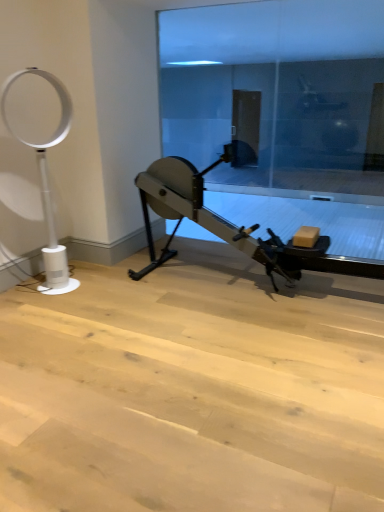
Where is `vacant area in front of transparent glass door at center`? Image resolution: width=384 pixels, height=512 pixels. vacant area in front of transparent glass door at center is located at coordinates click(x=248, y=322).